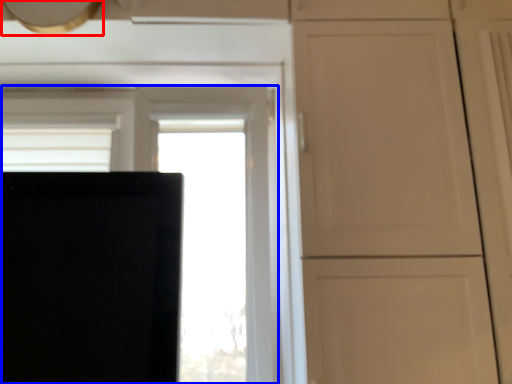
Question: Which object is further to the camera taking this photo, exhaust hood (highlighted by a red box) or window (highlighted by a blue box)?

Choices:
 (A) exhaust hood
 (B) window

Answer: (B)